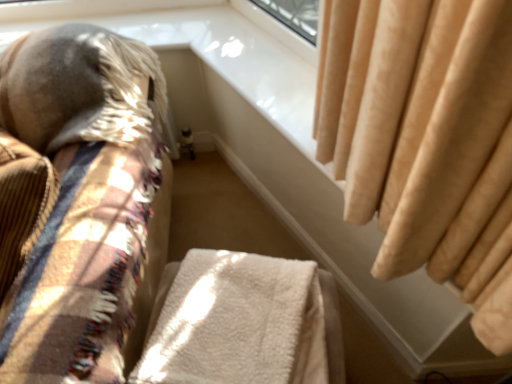
Question: From a real-world perspective, is soft beige fabric cushion at left beneath white fluffy blanket at center?

Choices:
 (A) no
 (B) yes

Answer: (B)

Question: Is the position of soft beige fabric cushion at left less distant than that of white fluffy blanket at center?

Choices:
 (A) no
 (B) yes

Answer: (B)

Question: Is soft beige fabric cushion at left oriented towards white fluffy blanket at center?

Choices:
 (A) no
 (B) yes

Answer: (A)

Question: Does soft beige fabric cushion at left have a greater height compared to white fluffy blanket at center?

Choices:
 (A) yes
 (B) no

Answer: (A)

Question: Is soft beige fabric cushion at left wider than white fluffy blanket at center?

Choices:
 (A) yes
 (B) no

Answer: (A)

Question: From a real-world perspective, is white fluffy blanket at center physically located above or below soft beige fabric cushion at left?

Choices:
 (A) below
 (B) above

Answer: (B)

Question: Visually, is white fluffy blanket at center positioned to the left or to the right of soft beige fabric cushion at left?

Choices:
 (A) left
 (B) right

Answer: (B)

Question: Looking at their shapes, would you say white fluffy blanket at center is wider or thinner than soft beige fabric cushion at left?

Choices:
 (A) thin
 (B) wide

Answer: (A)

Question: Relative to soft beige fabric cushion at left, is white fluffy blanket at center in front or behind?

Choices:
 (A) behind
 (B) front

Answer: (A)

Question: From a real-world perspective, relative to white fluffy blanket at center, is beige velvet curtain at upper right vertically above or below?

Choices:
 (A) above
 (B) below

Answer: (A)

Question: Is point (329, 76) positioned closer to the camera than point (189, 269)?

Choices:
 (A) closer
 (B) farther

Answer: (A)

Question: From the image's perspective, is beige velvet curtain at upper right above or below white fluffy blanket at center?

Choices:
 (A) below
 (B) above

Answer: (B)

Question: Is beige velvet curtain at upper right to the left or to the right of white fluffy blanket at center in the image?

Choices:
 (A) right
 (B) left

Answer: (A)

Question: Looking at their shapes, would you say white fluffy blanket at center is wider or thinner than beige velvet curtain at upper right?

Choices:
 (A) thin
 (B) wide

Answer: (A)

Question: Is white fluffy blanket at center to the left or to the right of beige velvet curtain at upper right in the image?

Choices:
 (A) right
 (B) left

Answer: (B)